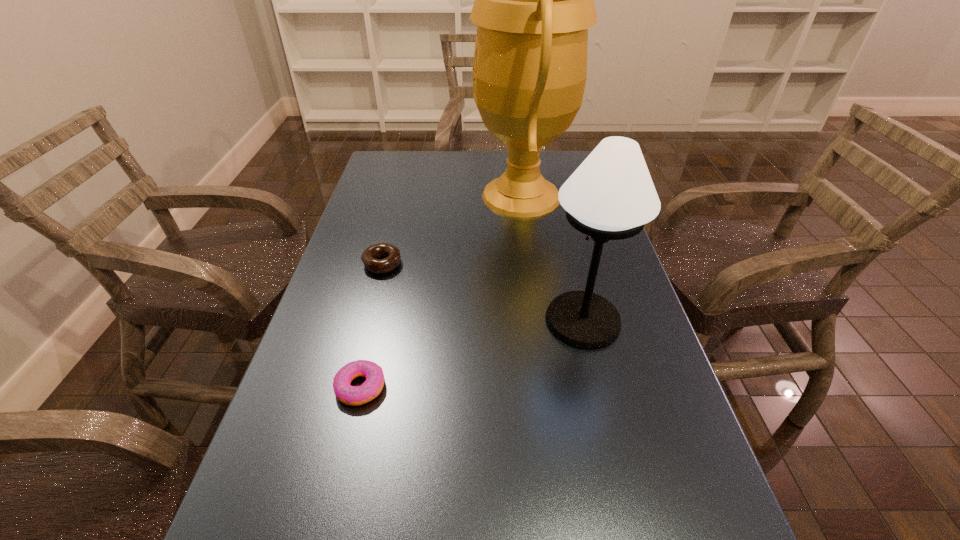
Locate an element on the screen. The height and width of the screenshot is (540, 960). vacant region located on the front of the nearest object is located at coordinates (329, 512).

This screenshot has height=540, width=960. Find the location of `object located in the far edge section of the desktop`. object located in the far edge section of the desktop is located at coordinates (534, 0).

Identify the location of trophy positioned at the right edge. The image size is (960, 540). (534, 0).

Locate an element on the screen. This screenshot has width=960, height=540. table lamp that is positioned at the right edge is located at coordinates (611, 196).

You are a GUI agent. You are given a task and a screenshot of the screen. Output one action in this format:
    pyautogui.click(x=<x>, y=<y>)
    Task: Click on the object that is positioned at the far right corner
    Image resolution: width=960 pixels, height=540 pixels.
    Given the screenshot: What is the action you would take?
    [534, 0]

This screenshot has height=540, width=960. In order to click on vacant space at the far edge in this screenshot , I will do `click(456, 163)`.

In the image, there is a desktop. At what (x,y) coordinates should I click in order to perform the action: click on vacant space at the left edge. Please return your answer as a coordinate pair (x, y). The image size is (960, 540). Looking at the image, I should click on (350, 438).

Where is `free space at the right edge of the desktop`? free space at the right edge of the desktop is located at coordinates pos(629,444).

The image size is (960, 540). In the image, there is a desktop. Find the location of `free space at the far left corner`. free space at the far left corner is located at coordinates tap(396, 171).

The height and width of the screenshot is (540, 960). In the image, there is a desktop. Find the location of `vacant space at the far right corner`. vacant space at the far right corner is located at coordinates (583, 154).